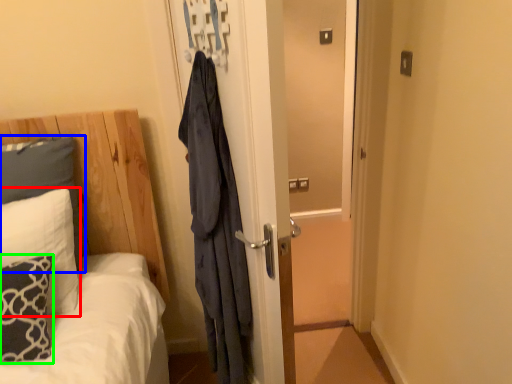
Question: Which object is positioned farthest from pillow (highlighted by a red box)? Select from pillow (highlighted by a blue box) and pillow (highlighted by a green box).

Choices:
 (A) pillow
 (B) pillow

Answer: (A)